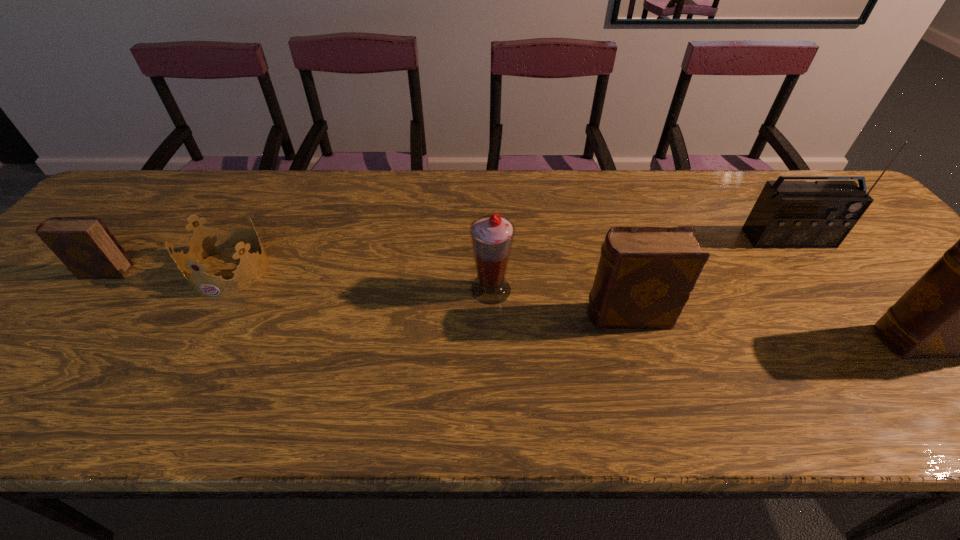
I want to click on the farthest diary, so click(87, 248).

In order to click on the leftmost object in this screenshot , I will do `click(87, 248)`.

The image size is (960, 540). Find the location of `the third object from right to left`. the third object from right to left is located at coordinates (645, 275).

Identify the location of the second shortest diary. [x=645, y=275].

Locate an element on the screen. Image resolution: width=960 pixels, height=540 pixels. radio receiver is located at coordinates (787, 214).

Identify the location of smoothie. (492, 236).

Locate an element on the screen. The height and width of the screenshot is (540, 960). tiara is located at coordinates (204, 241).

Identify the location of the shortest object. Image resolution: width=960 pixels, height=540 pixels. (204, 241).

This screenshot has width=960, height=540. In order to click on free space located on the spine side of the leftmost diary in this screenshot , I will do `click(43, 272)`.

Where is `blank space located on the spine side of the leftmost diary`? blank space located on the spine side of the leftmost diary is located at coordinates (60, 272).